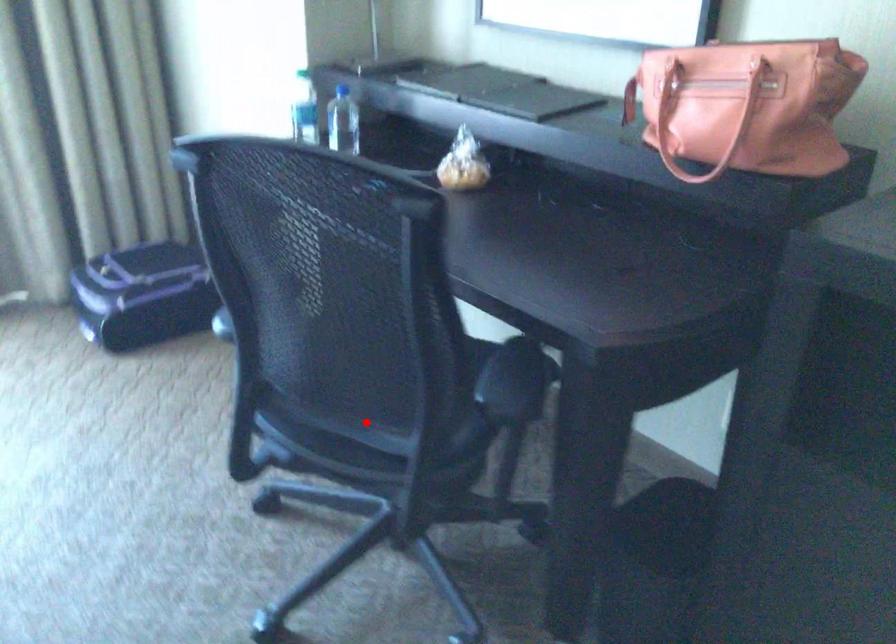
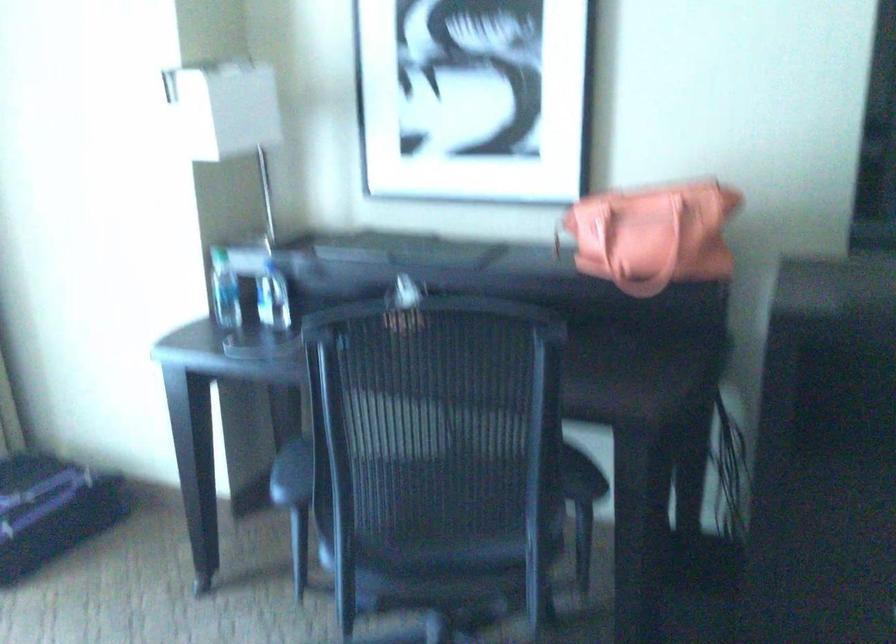
In the second image, find the point that corresponds to the highlighted location in the first image.

(458, 544)